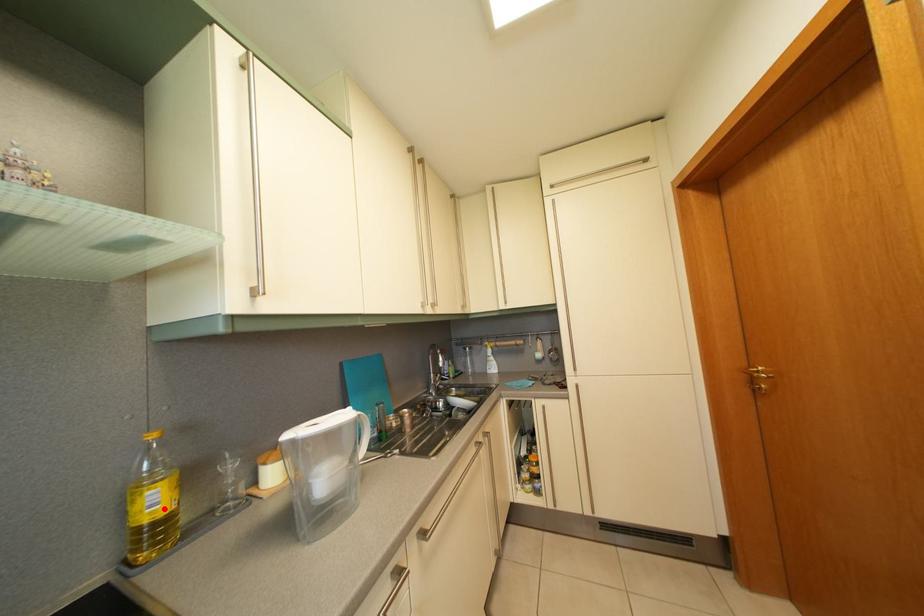
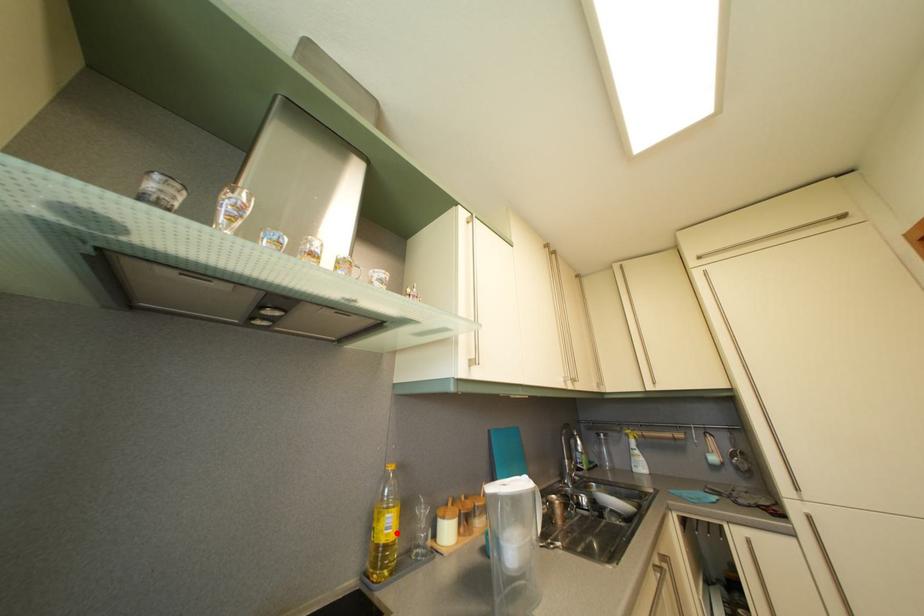
I am providing you with two images of the same scene from different viewpoints. A red point is marked on the first image and another point is marked on the second image. Does the point marked in image1 correspond to the same location as the one in image2?

Yes